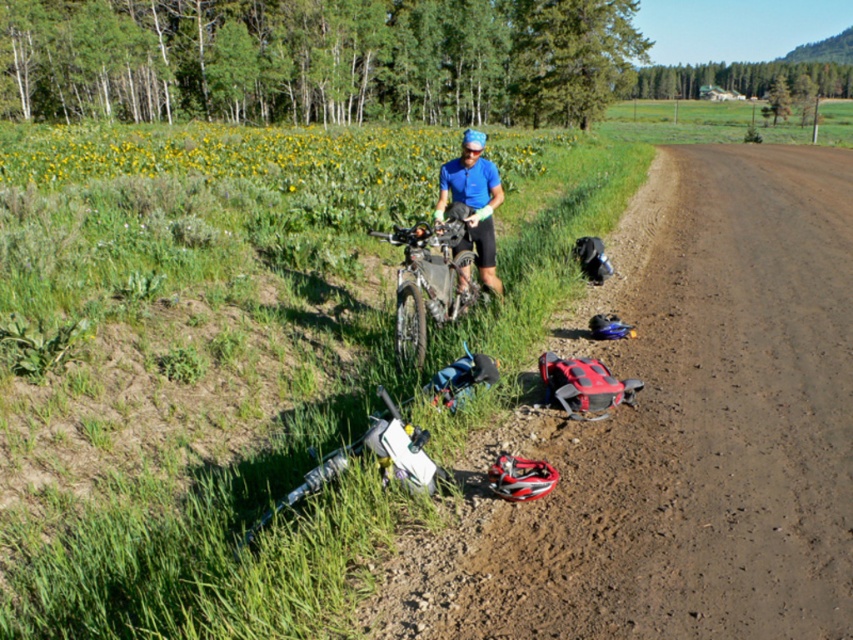
Can you confirm if brown dirt track at lower right is smaller than silver metallic mountain bike at center?

No.

Is point (824, 168) in front of point (416, 324)?

No, (824, 168) is behind (416, 324).

At what (x,y) coordinates should I click in order to perform the action: click on brown dirt track at lower right. Please return your answer as a coordinate pair (x, y). The width and height of the screenshot is (853, 640). Looking at the image, I should click on (679, 433).

Is the position of brown dirt track at lower right more distant than that of white matte mountain bike at lower left?

No.

This screenshot has height=640, width=853. I want to click on brown dirt track at lower right, so click(679, 433).

Who is more distant from viewer, (801, 488) or (405, 476)?

Point (801, 488)

Find the location of a particular element. This screenshot has height=640, width=853. brown dirt track at lower right is located at coordinates (679, 433).

Which is behind, point (370, 234) or point (376, 420)?

The point (370, 234) is more distant.

Does silver metallic mountain bike at center have a lesser height compared to white matte mountain bike at lower left?

Incorrect, silver metallic mountain bike at center's height does not fall short of white matte mountain bike at lower left's.

What do you see at coordinates (428, 282) in the screenshot?
I see `silver metallic mountain bike at center` at bounding box center [428, 282].

Image resolution: width=853 pixels, height=640 pixels. In order to click on silver metallic mountain bike at center in this screenshot , I will do (428, 282).